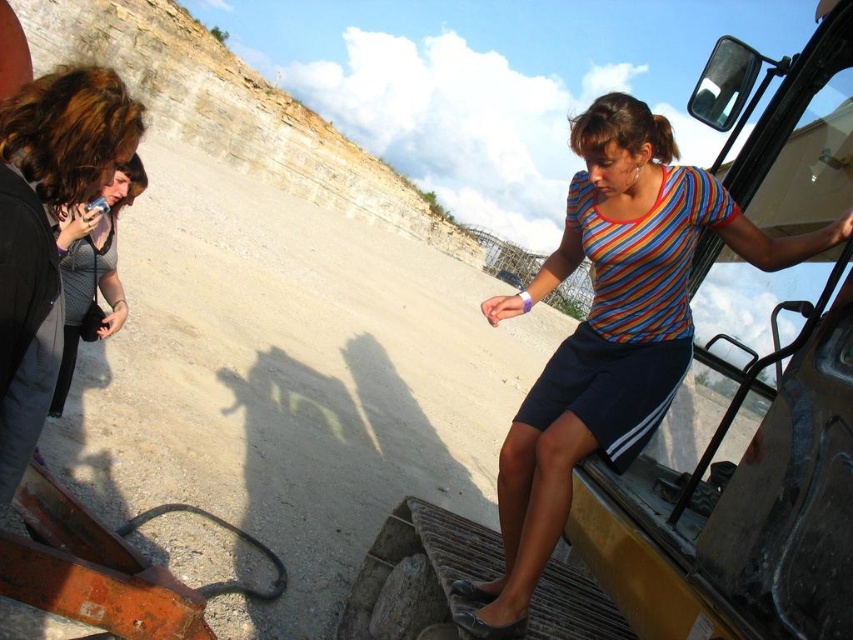
Does point (36, 346) lie in front of point (102, 285)?

That is True.

Does matte gray shirt at left appear over gray textured shirt at left?

Correct, matte gray shirt at left is located above gray textured shirt at left.

Is point (16, 337) positioned after point (108, 276)?

That is False.

Find the location of a particular element. The width and height of the screenshot is (853, 640). matte gray shirt at left is located at coordinates (45, 230).

In the scene shown: Between striped cotton shirt at upper right and matte gray shirt at left, which one is positioned lower?

striped cotton shirt at upper right is lower down.

Looking at this image, is striped cotton shirt at upper right closer to camera compared to matte gray shirt at left?

Yes, striped cotton shirt at upper right is closer to the viewer.

Does point (512, 589) come behind point (3, 284)?

That is True.

The height and width of the screenshot is (640, 853). In order to click on striped cotton shirt at upper right in this screenshot , I will do `click(527, 513)`.

Who is more forward, [601,250] or [57,416]?

Positioned in front is point [601,250].

At what (x,y) coordinates should I click in order to perform the action: click on striped cotton shirt at upper right. Please return your answer as a coordinate pair (x, y). Image resolution: width=853 pixels, height=640 pixels. Looking at the image, I should click on (527, 513).